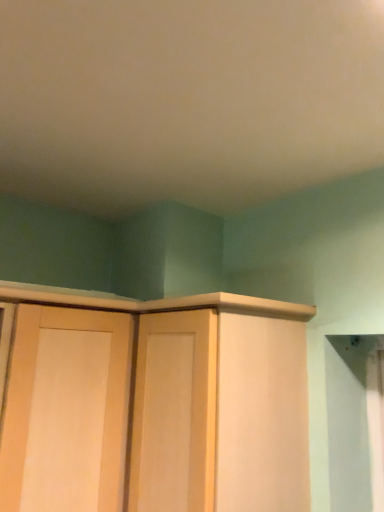
The width and height of the screenshot is (384, 512). What do you see at coordinates (155, 405) in the screenshot?
I see `light wood cabinet at center` at bounding box center [155, 405].

Where is `light wood cabinet at center`? The image size is (384, 512). light wood cabinet at center is located at coordinates (155, 405).

Describe the element at coordinates (66, 411) in the screenshot. I see `light wood door at center` at that location.

Where is `light wood door at center`? The width and height of the screenshot is (384, 512). light wood door at center is located at coordinates (66, 411).

You are a GUI agent. You are given a task and a screenshot of the screen. Output one action in this format:
    pyautogui.click(x=<x>, y=<y>)
    Task: Click on the light wood cabinet at center
    
    Given the screenshot: What is the action you would take?
    pyautogui.click(x=155, y=405)

Which object is positioned more to the right, light wood door at center or light wood cabinet at center?

light wood cabinet at center is more to the right.

Consider the image. Considering the positions of objects light wood door at center and light wood cabinet at center in the image provided, who is in front, light wood door at center or light wood cabinet at center?

light wood cabinet at center is in front.

Considering the points (68, 412) and (118, 350), which point is in front, point (68, 412) or point (118, 350)?

The point (68, 412) is in front.

From the image's perspective, is light wood door at center above light wood cabinet at center?

No, from the image's perspective, light wood door at center is not on top of light wood cabinet at center.

From a real-world perspective, which object stands above the other?

light wood cabinet at center is physically above.

Considering the relative sizes of light wood door at center and light wood cabinet at center in the image provided, is light wood door at center thinner than light wood cabinet at center?

In fact, light wood door at center might be wider than light wood cabinet at center.

Looking at this image, who is taller, light wood door at center or light wood cabinet at center?

light wood door at center.

Can you confirm if light wood door at center is bigger than light wood cabinet at center?

Correct, light wood door at center is larger in size than light wood cabinet at center.

Is light wood cabinet at center located within light wood door at center?

No, light wood cabinet at center is located outside of light wood door at center.

Is light wood door at center touching light wood cabinet at center?

No, light wood door at center is not next to light wood cabinet at center.

Is light wood door at center facing towards light wood cabinet at center?

No, light wood door at center is not facing towards light wood cabinet at center.

Consider the image. How many degrees apart are the facing directions of light wood door at center and light wood cabinet at center?

The angle between the facing direction of light wood door at center and the facing direction of light wood cabinet at center is 90 degrees.

Find the location of a particular element. door that appears below the light wood cabinet at center (from the image's perspective) is located at coordinates (66, 411).

In the image, is light wood cabinet at center on the left side or the right side of light wood door at center?

Clearly, light wood cabinet at center is on the right of light wood door at center in the image.

Which object is closer to the camera taking this photo, light wood cabinet at center or light wood door at center?

light wood cabinet at center is closer to the camera.

Does point (81, 411) appear closer or farther from the camera than point (44, 474)?

Clearly, point (81, 411) is more distant from the camera than point (44, 474).

From the picture: From the image's perspective, which one is positioned higher, light wood cabinet at center or light wood door at center?

From the image's view, light wood cabinet at center is above.

From a real-world perspective, is light wood cabinet at center physically located above or below light wood door at center?

From a real-world perspective, light wood cabinet at center is physically above light wood door at center.

Can you confirm if light wood cabinet at center is thinner than light wood door at center?

Yes, light wood cabinet at center is thinner than light wood door at center.

Considering the sizes of objects light wood cabinet at center and light wood door at center in the image provided, who is taller, light wood cabinet at center or light wood door at center?

light wood door at center.

Considering the sizes of objects light wood cabinet at center and light wood door at center in the image provided, who is bigger, light wood cabinet at center or light wood door at center?

Bigger between the two is light wood door at center.

Which is correct: light wood cabinet at center is inside light wood door at center, or outside of it?

light wood cabinet at center cannot be found inside light wood door at center.

Is there a large distance between light wood cabinet at center and light wood door at center?

They are positioned close to each other.

Is light wood cabinet at center positioned with its back to light wood door at center?

No, light wood cabinet at center's orientation is not away from light wood door at center.

How different are the orientations of light wood cabinet at center and light wood door at center in degrees?

light wood cabinet at center and light wood door at center are facing 90 degrees away from each other.

This screenshot has width=384, height=512. I want to click on door below the light wood cabinet at center (from a real-world perspective), so pos(66,411).

Identify the location of cupboard that appears on the right of light wood door at center. (155, 405).

Where is `cupboard located above the light wood door at center (from a real-world perspective)`? cupboard located above the light wood door at center (from a real-world perspective) is located at coordinates (155, 405).